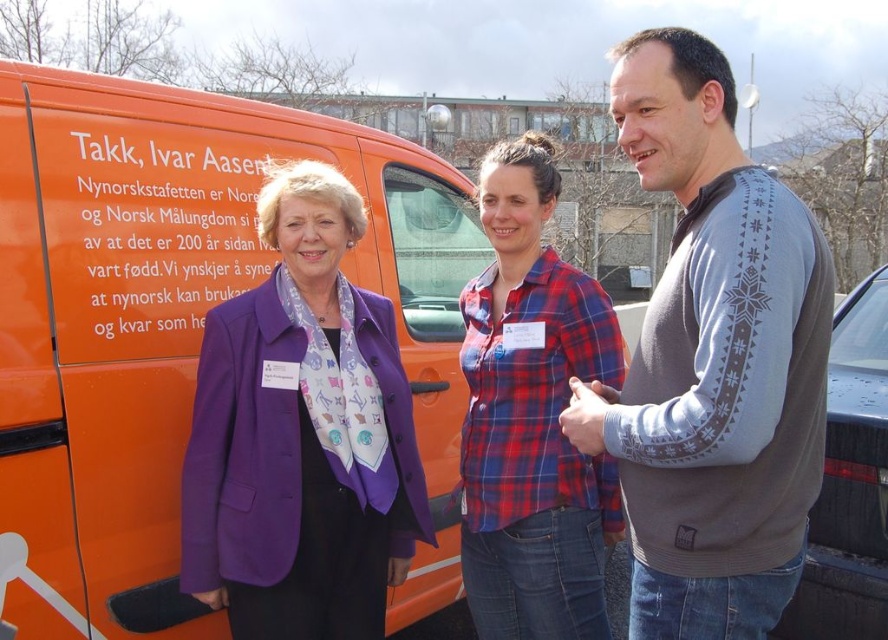
This screenshot has width=888, height=640. Describe the element at coordinates (180, 328) in the screenshot. I see `orange matte van at center` at that location.

Is orange matte van at center shorter than purple satin blazer at center?

No.

What are the coordinates of `orange matte van at center` in the screenshot? It's located at (180, 328).

You are a GUI agent. You are given a task and a screenshot of the screen. Output one action in this format:
    pyautogui.click(x=<x>, y=<y>)
    Task: Click on the orange matte van at center
    Image resolution: width=888 pixels, height=640 pixels.
    Given the screenshot: What is the action you would take?
    pyautogui.click(x=180, y=328)

Measure the distance between gray sweater at center and camera.

1.45 meters

Can you confirm if gray sweater at center is positioned below purple satin blazer at center?

Incorrect, gray sweater at center is not positioned below purple satin blazer at center.

You are a GUI agent. You are given a task and a screenshot of the screen. Output one action in this format:
    pyautogui.click(x=<x>, y=<y>)
    Task: Click on the gray sweater at center
    This screenshot has width=888, height=640.
    Given the screenshot: What is the action you would take?
    pyautogui.click(x=712, y=362)

Does gray sweater at center lie behind plaid fabric shirt at center?

No, gray sweater at center is in front of plaid fabric shirt at center.

Is gray sweater at center wider than plaid fabric shirt at center?

Indeed, gray sweater at center has a greater width compared to plaid fabric shirt at center.

Who is more distant from viewer, (801,225) or (522,490)?

Point (522,490)

Find the location of a particular element. gray sweater at center is located at coordinates (712, 362).